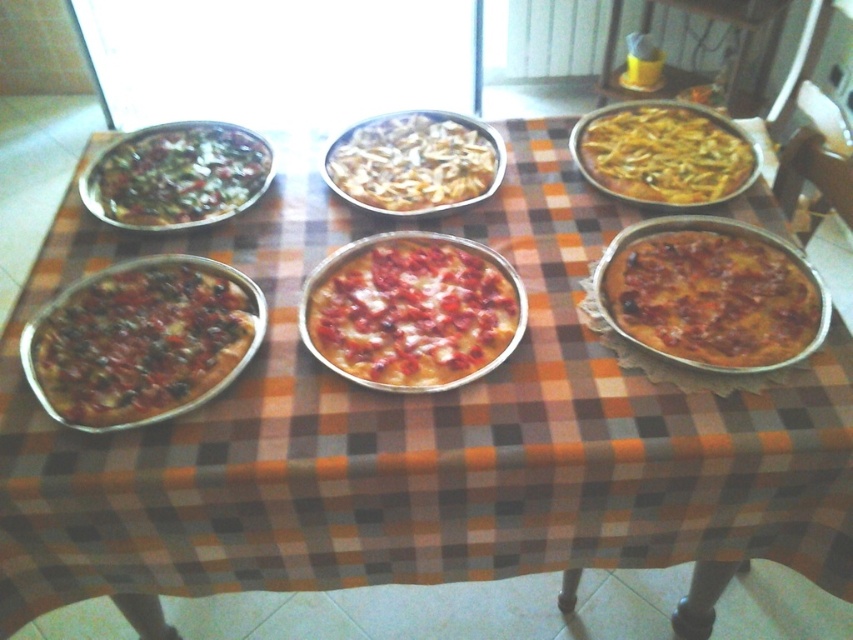
Question: Does dark brown crusty pizza at left have a larger size compared to green leafy pizza at upper left?

Choices:
 (A) yes
 (B) no

Answer: (B)

Question: Which object is the farthest from the yellow cheese pizza at upper right?

Choices:
 (A) dark brown crusty pizza at left
 (B) golden brown crusty pizza at center right
 (C) cheesy white pizza at center
 (D) green leafy pizza at upper left

Answer: (A)

Question: Can you confirm if cheesy pizza at center is positioned to the right of golden brown crusty pizza at center right?

Choices:
 (A) yes
 (B) no

Answer: (B)

Question: Which object appears farthest from the camera in this image?

Choices:
 (A) dark brown crusty pizza at left
 (B) cheesy pizza at center
 (C) green leafy pizza at upper left
 (D) cheesy white pizza at center

Answer: (D)

Question: Is the position of cheesy pizza at center more distant than that of cheesy white pizza at center?

Choices:
 (A) no
 (B) yes

Answer: (A)

Question: Which point is closer to the camera?

Choices:
 (A) (668, 164)
 (B) (631, 320)
 (C) (393, 131)
 (D) (202, 157)

Answer: (B)